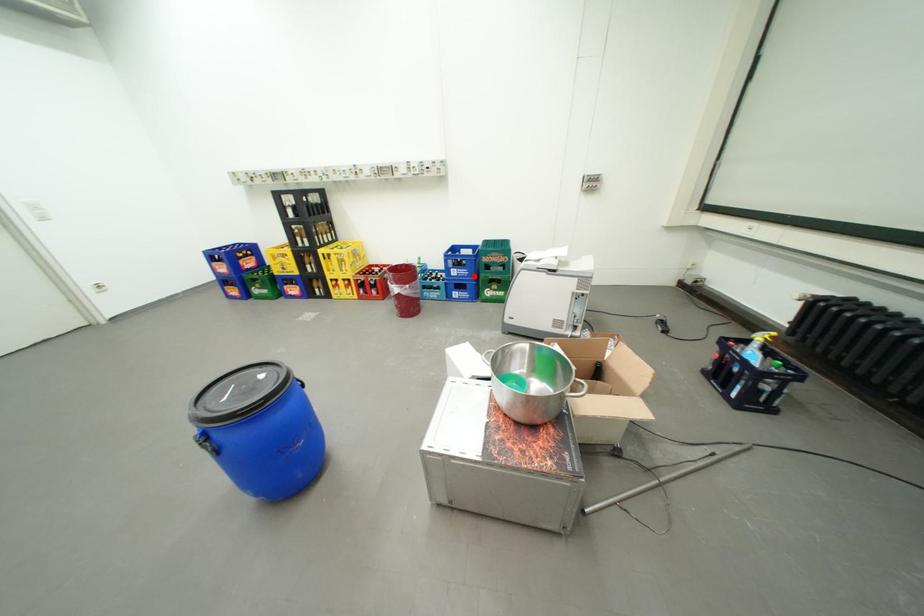
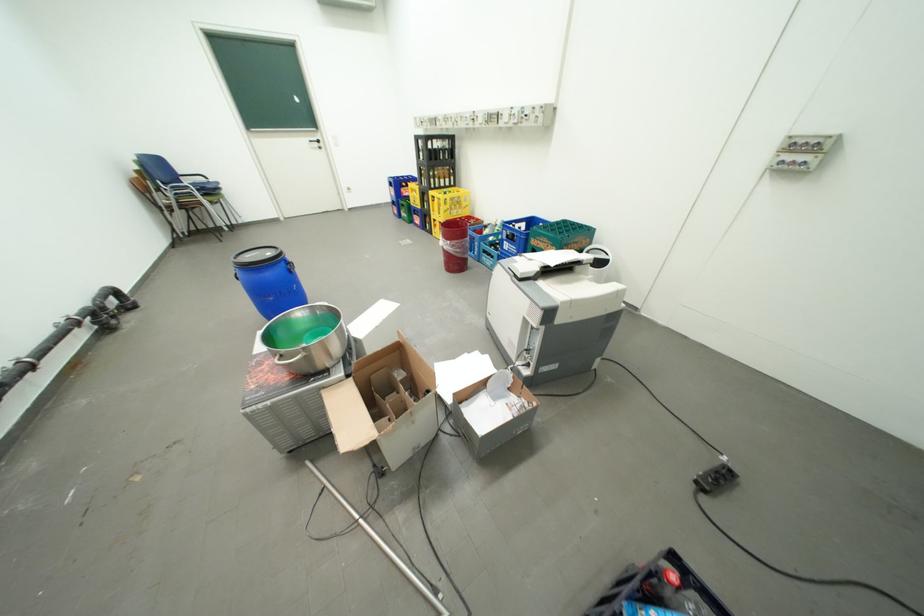
In the second image, find the point that corresponds to the highlighted location in the first image.

(523, 253)